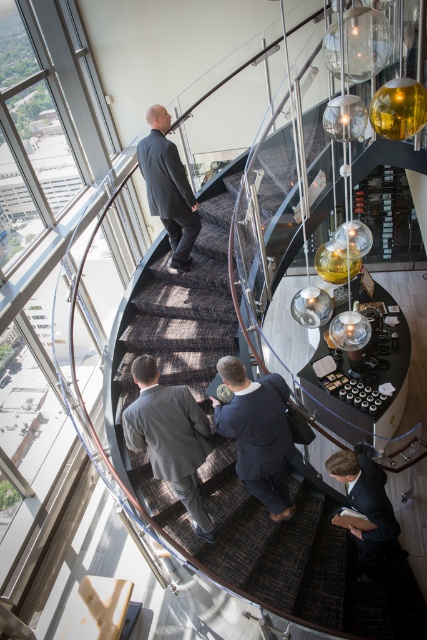
Measure the distance between point [277,449] and camera.

A distance of 3.24 meters exists between point [277,449] and camera.

Identify the location of dark blue suit at center. click(x=257, y=435).

Who is shorter, brown carpeted stairs at center or dark blue suit at center?

dark blue suit at center

Can you confirm if brown carpeted stairs at center is positioned to the right of dark blue suit at center?

No, brown carpeted stairs at center is not to the right of dark blue suit at center.

Is point (175, 330) positioned in front of point (280, 410)?

No, (175, 330) is behind (280, 410).

Identify the location of brown carpeted stairs at center. This screenshot has width=427, height=640. (230, 442).

Image resolution: width=427 pixels, height=640 pixels. What do you see at coordinates (257, 435) in the screenshot? I see `dark blue suit at center` at bounding box center [257, 435].

Looking at this image, is dark blue suit at center smaller than dark gray suit at upper center?

No, dark blue suit at center is not smaller than dark gray suit at upper center.

Describe the element at coordinates (257, 435) in the screenshot. The height and width of the screenshot is (640, 427). I see `dark blue suit at center` at that location.

Locate an element on the screen. dark blue suit at center is located at coordinates (257, 435).